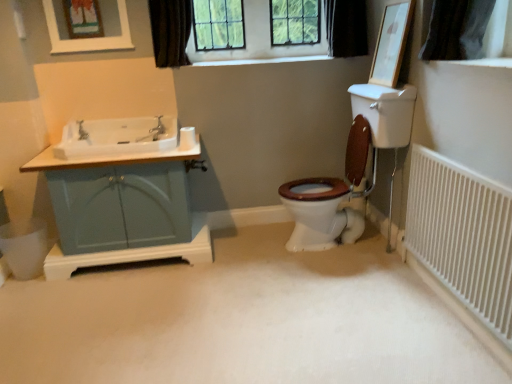
Find the location of `free area below white metal radiator at lower right (from a real-world perspective)`. free area below white metal radiator at lower right (from a real-world perspective) is located at coordinates (444, 303).